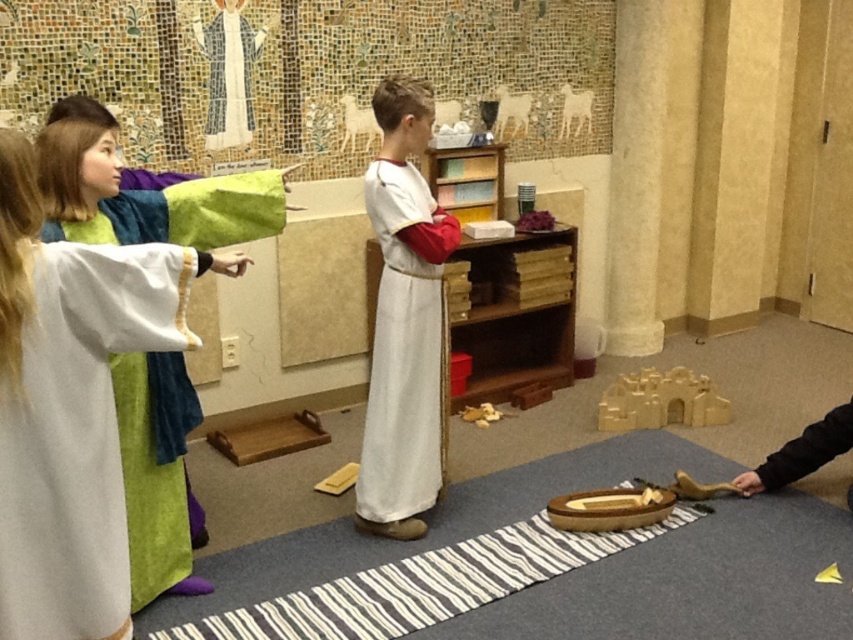
Does point (120, 380) come closer to viewer compared to point (384, 339)?

Yes, it is.

Can you confirm if white soft fabric robe at left is positioned to the left of white cotton dress at center?

Indeed, white soft fabric robe at left is positioned on the left side of white cotton dress at center.

Does point (138, 576) lie behind point (407, 285)?

No.

Find the location of `white soft fabric robe at left`. white soft fabric robe at left is located at coordinates (155, 470).

Looking at this image, is white soft fabric robe at left bigger than black fabric robe at lower right?

Correct, white soft fabric robe at left is larger in size than black fabric robe at lower right.

What do you see at coordinates (155, 470) in the screenshot? I see `white soft fabric robe at left` at bounding box center [155, 470].

This screenshot has width=853, height=640. I want to click on white soft fabric robe at left, so click(155, 470).

This screenshot has height=640, width=853. I want to click on white cotton dress at center, so click(x=403, y=355).

Where is `white cotton dress at center`? Image resolution: width=853 pixels, height=640 pixels. white cotton dress at center is located at coordinates (403, 355).